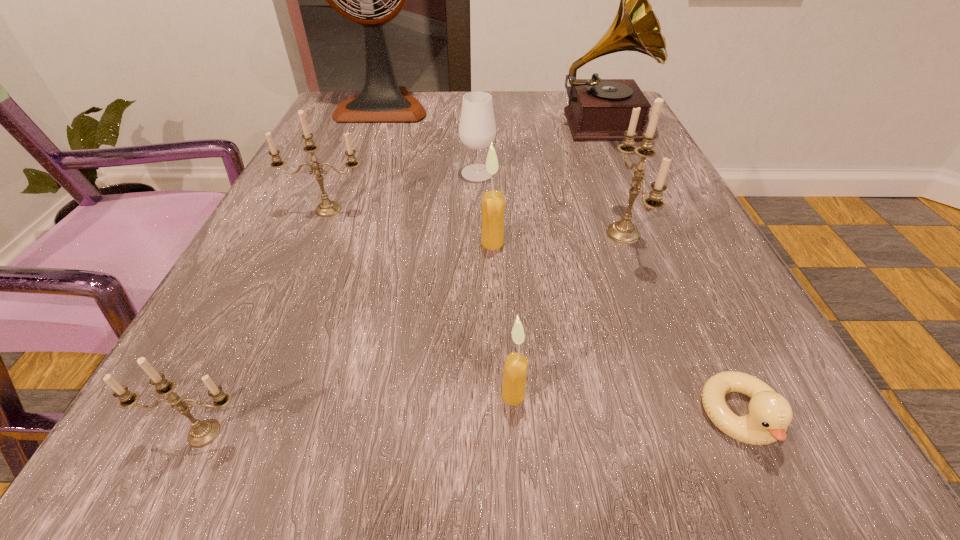
This screenshot has height=540, width=960. In order to click on the smaller cream candle in this screenshot , I will do `click(515, 367)`.

Identify the location of the smallest metallic candle. Image resolution: width=960 pixels, height=540 pixels. (202, 433).

Find the location of a particular element. The width and height of the screenshot is (960, 540). the nearest metallic candle is located at coordinates (202, 433).

I want to click on the shortest object, so click(x=770, y=414).

Identify the location of free location located on the front-facing side of the tallest object. (364, 158).

Locate an element on the screen. The height and width of the screenshot is (540, 960). vacant space located 0.330m from the horn of the brown phonograph record is located at coordinates (660, 260).

I want to click on vacant space located 0.080m on the front of the third tallest object, so click(x=652, y=311).

The width and height of the screenshot is (960, 540). I want to click on vacant space located 0.240m on the left of the bigger cream candle, so click(332, 243).

Where is `vacant region located 0.160m on the front of the second smallest metallic candle`? vacant region located 0.160m on the front of the second smallest metallic candle is located at coordinates (298, 282).

This screenshot has width=960, height=540. I want to click on vacant space located on the right of the glass, so click(659, 173).